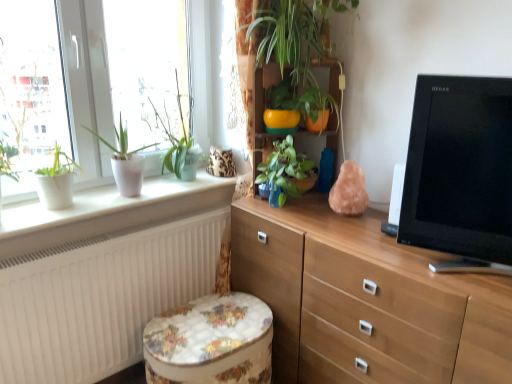
This screenshot has width=512, height=384. In order to click on empty space that is ontop of white glossy window sill at left in this screenshot , I will do `click(123, 197)`.